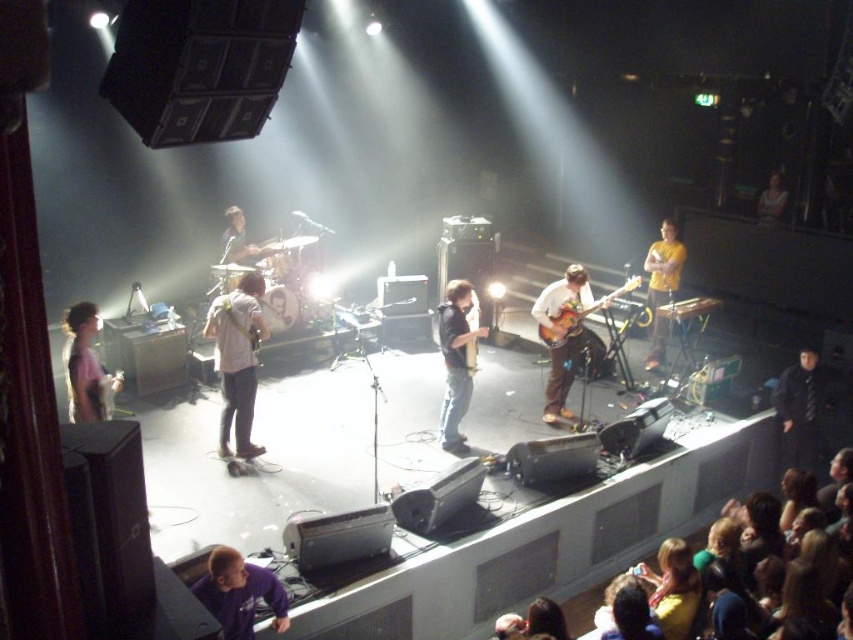
Can you confirm if matte brown guitar at center is positioned to the left of yellow matte shirt at center?

Indeed, matte brown guitar at center is positioned on the left side of yellow matte shirt at center.

Can you confirm if matte brown guitar at center is positioned above yellow matte shirt at center?

No.

Locate an element on the screen. This screenshot has height=640, width=853. matte brown guitar at center is located at coordinates (561, 337).

Is purple fleece at lower left wider than wooden acoustic guitar at center?

No.

Between purple fleece at lower left and wooden acoustic guitar at center, which one appears on the right side from the viewer's perspective?

wooden acoustic guitar at center

Is point (247, 611) positioned after point (700, 298)?

That is False.

Where is `purple fleece at lower left`? Image resolution: width=853 pixels, height=640 pixels. purple fleece at lower left is located at coordinates (239, 593).

Does white matte guitar at center have a lesser height compared to yellow matte shirt at center?

Yes, white matte guitar at center is shorter than yellow matte shirt at center.

Who is positioned more to the right, white matte guitar at center or yellow matte shirt at center?

yellow matte shirt at center is more to the right.

Between point (248, 305) and point (653, 339), which one is positioned in front?

Point (248, 305)

This screenshot has width=853, height=640. In order to click on white matte guitar at center in this screenshot , I will do `click(236, 358)`.